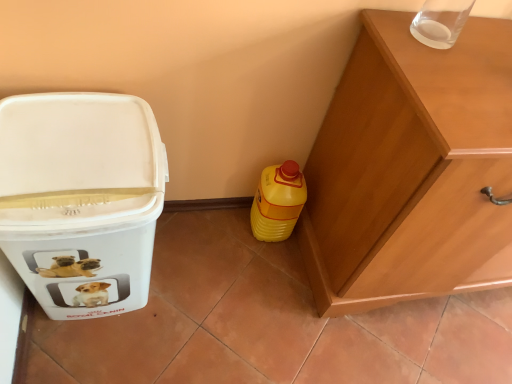
Where is `empty space that is ontop of white plastic container at left (from a real-world perspective)`? empty space that is ontop of white plastic container at left (from a real-world perspective) is located at coordinates (78, 150).